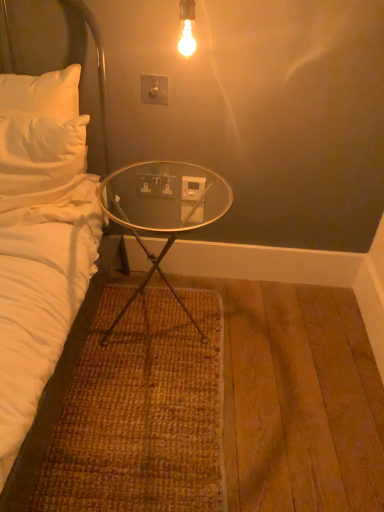
The width and height of the screenshot is (384, 512). I want to click on white plastic power outlet at center, so click(x=192, y=188).

I want to click on white plastic switch at upper center, acting as the 1th electric outlet starting from the top, so click(154, 89).

This screenshot has width=384, height=512. What do you see at coordinates (155, 185) in the screenshot?
I see `white plastic electric outlet at center, which is the second electric outlet in front-to-back order` at bounding box center [155, 185].

This screenshot has height=512, width=384. In order to click on white plastic power outlet at center in this screenshot , I will do click(192, 188).

Is white plastic power outlet at center looking in the opposite direction of white plastic switch at upper center, acting as the 1th electric outlet starting from the top?

white plastic power outlet at center does not have its back to white plastic switch at upper center, acting as the 1th electric outlet starting from the top.

Looking at this image, considering the relative sizes of white plastic power outlet at center and white plastic switch at upper center, marked as the second electric outlet in a back-to-front arrangement, in the image provided, is white plastic power outlet at center shorter than white plastic switch at upper center, marked as the second electric outlet in a back-to-front arrangement,?

Yes, white plastic power outlet at center is shorter than white plastic switch at upper center, marked as the second electric outlet in a back-to-front arrangement.

Can you confirm if white plastic power outlet at center is positioned to the left of white plastic switch at upper center, acting as the 1th electric outlet starting from the top?

Incorrect, white plastic power outlet at center is not on the left side of white plastic switch at upper center, acting as the 1th electric outlet starting from the top.

Locate an element on the screen. electric outlet above the white plastic power outlet at center (from a real-world perspective) is located at coordinates (154, 89).

In the scene shown: Is white soft bed at left taller than white plastic power outlet at center?

Yes, white soft bed at left is taller than white plastic power outlet at center.

Consider the image. Can you confirm if white soft bed at left is positioned to the left of white plastic power outlet at center?

Correct, you'll find white soft bed at left to the left of white plastic power outlet at center.

Can you tell me how much white soft bed at left and white plastic power outlet at center differ in facing direction?

The angular difference between white soft bed at left and white plastic power outlet at center is 4.03 degrees.

Is white soft bed at left positioned beyond the bounds of white plastic power outlet at center?

Yes.

Which of these two, white plastic power outlet at center or white soft bed at left, is wider?

white soft bed at left.

Is white plastic power outlet at center closer to camera compared to white soft bed at left?

No.

Based on the photo, which is farther, (x=195, y=198) or (x=87, y=323)?

The point (x=195, y=198) is more distant.

Is white plastic power outlet at center shorter than white soft bed at left?

Yes.

Is white plastic electric outlet at center, marked as the 2th electric outlet in a top-to-bottom arrangement, inside the boundaries of transparent glass table at center, or outside?

white plastic electric outlet at center, marked as the 2th electric outlet in a top-to-bottom arrangement, is located beyond the bounds of transparent glass table at center.

Is white plastic electric outlet at center, which is the second electric outlet in front-to-back order, in front of or behind transparent glass table at center in the image?

white plastic electric outlet at center, which is the second electric outlet in front-to-back order, is behind transparent glass table at center.

Between white plastic electric outlet at center, marked as the 2th electric outlet in a top-to-bottom arrangement, and transparent glass table at center, which one has smaller size?

Smaller between the two is white plastic electric outlet at center, marked as the 2th electric outlet in a top-to-bottom arrangement.

Which is in front, point (157, 195) or point (149, 203)?

Point (149, 203)

Based on the photo, which is less distant, (140, 206) or (189, 191)?

The point (189, 191) is closer.

Is transparent glass table at center not inside white plastic power outlet at center?

Yes.

Is transparent glass table at center wider than white plastic power outlet at center?

Yes.

From the image's perspective, is transparent glass table at center under white plastic power outlet at center?

Yes, from the image's perspective, transparent glass table at center is below white plastic power outlet at center.

Visually, is transparent glass table at center positioned to the left or to the right of white plastic electric outlet at center, which is the second electric outlet in front-to-back order?

Clearly, transparent glass table at center is on the right of white plastic electric outlet at center, which is the second electric outlet in front-to-back order, in the image.

Is transparent glass table at center next to white plastic electric outlet at center, which appears as the 1th electric outlet when viewed from the back?

No, transparent glass table at center is not in contact with white plastic electric outlet at center, which appears as the 1th electric outlet when viewed from the back.

Considering their positions, is transparent glass table at center located in front of or behind white plastic electric outlet at center, marked as the 2th electric outlet in a top-to-bottom arrangement?

Visually, transparent glass table at center is located in front of white plastic electric outlet at center, marked as the 2th electric outlet in a top-to-bottom arrangement.

Does transparent glass table at center turn towards white plastic electric outlet at center, which appears as the 1th electric outlet when viewed from the back?

No.

Between white plastic switch at upper center, marked as the second electric outlet in a back-to-front arrangement, and white plastic electric outlet at center, which is the second electric outlet in front-to-back order, which one is positioned behind?

Positioned behind is white plastic electric outlet at center, which is the second electric outlet in front-to-back order.

Considering the sizes of objects white plastic switch at upper center, placed as the 2th electric outlet when sorted from bottom to top, and white plastic electric outlet at center, positioned as the 1th electric outlet in bottom-to-top order, in the image provided, who is thinner, white plastic switch at upper center, placed as the 2th electric outlet when sorted from bottom to top, or white plastic electric outlet at center, positioned as the 1th electric outlet in bottom-to-top order,?

With smaller width is white plastic electric outlet at center, positioned as the 1th electric outlet in bottom-to-top order.

How many degrees apart are the facing directions of white plastic switch at upper center, marked as the second electric outlet in a back-to-front arrangement, and white plastic electric outlet at center, which appears as the 1th electric outlet when viewed from the back?

0.0263 degrees.

Locate an element on the screen. power outlet on the right of white plastic switch at upper center, acting as the 1th electric outlet starting from the top is located at coordinates coord(192,188).

Where is `power outlet above the white soft bed at left (from the image's perspective)`? The width and height of the screenshot is (384, 512). power outlet above the white soft bed at left (from the image's perspective) is located at coordinates (192, 188).

Looking at the image, which one is located further to white plastic electric outlet at center, positioned as the 1th electric outlet in bottom-to-top order, white plastic power outlet at center or white soft bed at left?

white soft bed at left lies further to white plastic electric outlet at center, positioned as the 1th electric outlet in bottom-to-top order, than the other object.

When comparing their distances from white plastic switch at upper center, placed as the 2th electric outlet when sorted from bottom to top, does white plastic electric outlet at center, marked as the 2th electric outlet in a top-to-bottom arrangement, or white soft bed at left seem further?

Based on the image, white soft bed at left appears to be further to white plastic switch at upper center, placed as the 2th electric outlet when sorted from bottom to top.

Estimate the real-world distances between objects in this image. Which object is further from white plastic switch at upper center, placed as the 2th electric outlet when sorted from bottom to top, white soft bed at left or transparent glass table at center?

white soft bed at left.

Based on the photo, looking at the image, which one is located further to white plastic power outlet at center, white plastic electric outlet at center, positioned as the 1th electric outlet in bottom-to-top order, or transparent glass table at center?

transparent glass table at center.

Estimate the real-world distances between objects in this image. Which object is closer to white soft bed at left, transparent glass table at center or white plastic switch at upper center, acting as the 1th electric outlet starting from the top?

transparent glass table at center is positioned closer to the anchor white soft bed at left.

Which object lies further to the anchor point white plastic electric outlet at center, which appears as the 1th electric outlet when viewed from the back, white plastic switch at upper center, marked as the 1th electric outlet in a front-to-back arrangement, or white soft bed at left?

Among the two, white soft bed at left is located further to white plastic electric outlet at center, which appears as the 1th electric outlet when viewed from the back.

Which object lies further to the anchor point white plastic power outlet at center, white plastic switch at upper center, marked as the second electric outlet in a back-to-front arrangement, or white plastic electric outlet at center, which is the second electric outlet in front-to-back order?

white plastic switch at upper center, marked as the second electric outlet in a back-to-front arrangement, is further to white plastic power outlet at center.

Which object lies nearer to the anchor point white plastic power outlet at center, white soft bed at left or white plastic electric outlet at center, which is the second electric outlet in front-to-back order?

white plastic electric outlet at center, which is the second electric outlet in front-to-back order, is positioned closer to the anchor white plastic power outlet at center.

I want to click on electric outlet located between white soft bed at left and white plastic electric outlet at center, marked as the 2th electric outlet in a top-to-bottom arrangement, in the depth direction, so click(154, 89).

The width and height of the screenshot is (384, 512). Identify the location of power outlet between white plastic switch at upper center, marked as the 1th electric outlet in a front-to-back arrangement, and transparent glass table at center, in the vertical direction. (192, 188).

Image resolution: width=384 pixels, height=512 pixels. In order to click on desk between white soft bed at left and white plastic power outlet at center in the front-back direction in this screenshot , I will do `click(162, 213)`.

Image resolution: width=384 pixels, height=512 pixels. I want to click on electric outlet between white plastic switch at upper center, marked as the second electric outlet in a back-to-front arrangement, and white plastic power outlet at center, in the vertical direction, so coord(155,185).